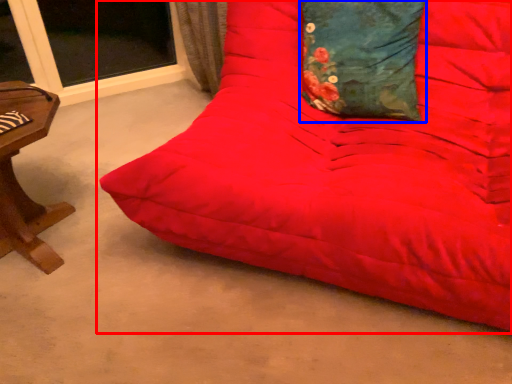
Question: Which object is further to the camera taking this photo, studio couch (highlighted by a red box) or pillow (highlighted by a blue box)?

Choices:
 (A) studio couch
 (B) pillow

Answer: (B)